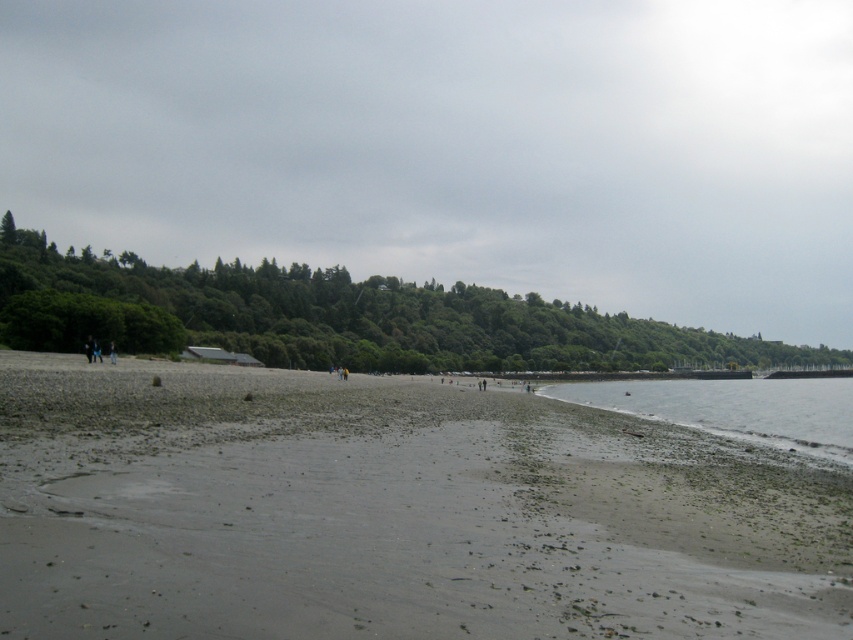
From the picture: You are standing on the beach and want to take a photo of both the point at coordinates (610, 72) and the point at (717, 424). Which point should you focus on first to ensure both are in focus?

You should focus on the point at coordinates (610, 72) first because it is closer to the camera than the point at (717, 424). This ensures that both points will be in focus when using depth of field.

You are standing on the smooth sand beach at center and want to reach the clear water at lower right. Which direction should you move to get there?

You should move downward towards the clear water at lower right because the smooth sand beach at center is above it.

You are standing on the smooth sand beach at center and want to climb up to the green leafy hillside at upper center. Is the hillside above or below you?

The green leafy hillside at upper center is positioned over the smooth sand beach at center, so it is above you.